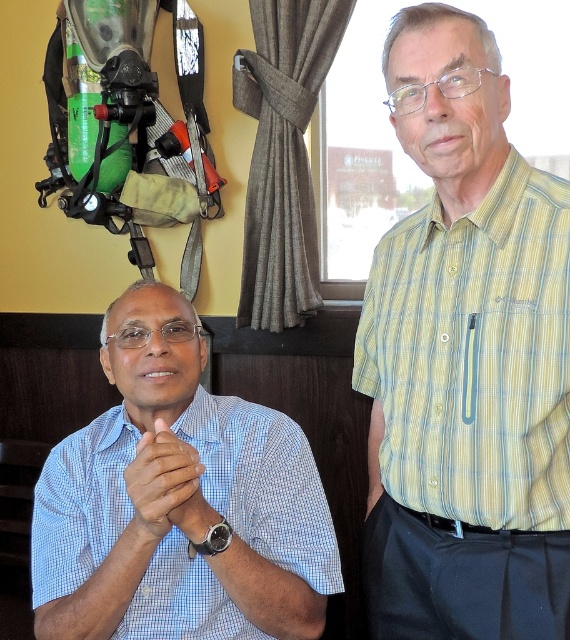
You are taking a photo of two people sitting in a room with a window. You want to focus on the person at point [515,289] and the person at point [149,444]. Which person will be in focus if you adjust the camera to focus on the closer one?

Point [515,289] is closer to the camera than point [149,444], so the person at point [515,289] will be in focus.

You are a photographer setting up a shoot in the room. You need to position a light source to the left of the brown leather watch at center so it illuminates the yellow striped shirt at center. Is the current arrangement of these objects suitable for this lighting setup?

The yellow striped shirt at center is to the right of the brown leather watch at center, so placing the light source to the left of the brown leather watch at center would direct light towards the yellow striped shirt at center, making the setup suitable.

You are a photographer standing 1.5 meters away from the yellow striped shirt at center. You want to take a photo of the shirt while staying in your current position. Is the shirt within your camera lens range if the minimum focusing distance is 1.0 meters?

The yellow striped shirt at center is 1.02 meters away from the camera. Since your minimum focusing distance is 1.0 meters, the shirt is within the camera lens range and can be focused properly.